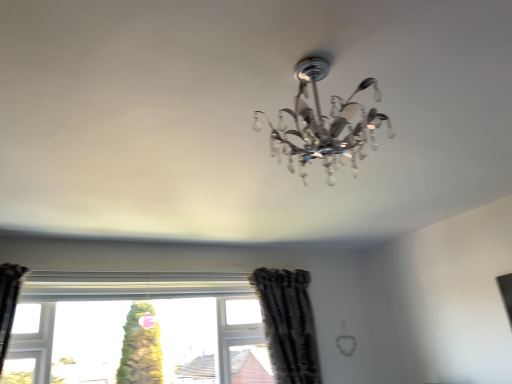
Question: Is black textured curtain at lower center located within clear glass window at center?

Choices:
 (A) yes
 (B) no

Answer: (B)

Question: Is the depth of clear glass window at center greater than that of black textured curtain at lower center?

Choices:
 (A) no
 (B) yes

Answer: (A)

Question: Can we say clear glass window at center lies outside black textured curtain at lower center?

Choices:
 (A) no
 (B) yes

Answer: (B)

Question: Is clear glass window at center touching black textured curtain at lower center?

Choices:
 (A) no
 (B) yes

Answer: (A)

Question: Are clear glass window at center and black textured curtain at lower center located far from each other?

Choices:
 (A) yes
 (B) no

Answer: (B)

Question: Does clear glass window at center appear on the right side of black textured curtain at lower center?

Choices:
 (A) no
 (B) yes

Answer: (A)

Question: Does black textured curtain at lower center have a lesser width compared to clear glass window at center?

Choices:
 (A) yes
 (B) no

Answer: (B)

Question: Is black textured curtain at lower center at the right side of clear glass window at center?

Choices:
 (A) yes
 (B) no

Answer: (A)

Question: Considering the relative positions of black textured curtain at lower center and clear glass window at center in the image provided, is black textured curtain at lower center to the left of clear glass window at center from the viewer's perspective?

Choices:
 (A) yes
 (B) no

Answer: (B)

Question: Does black textured curtain at lower center have a greater height compared to clear glass window at center?

Choices:
 (A) yes
 (B) no

Answer: (A)

Question: From a real-world perspective, is black textured curtain at lower center under clear glass window at center?

Choices:
 (A) yes
 (B) no

Answer: (B)

Question: From the image's perspective, is black textured curtain at lower center under clear glass window at center?

Choices:
 (A) no
 (B) yes

Answer: (A)

Question: In terms of size, does clear glass window at center appear bigger or smaller than black textured curtain at lower center?

Choices:
 (A) small
 (B) big

Answer: (B)